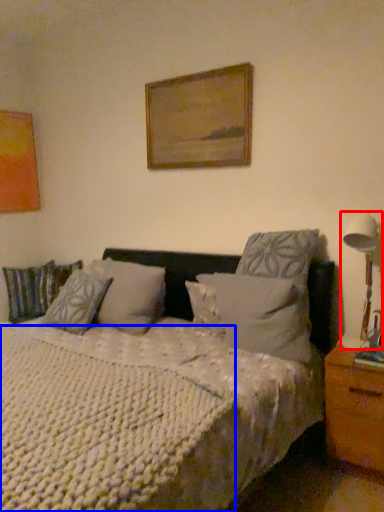
Question: Which object appears closest to the camera in this image, table lamp (highlighted by a red box) or mattress (highlighted by a blue box)?

Choices:
 (A) table lamp
 (B) mattress

Answer: (B)